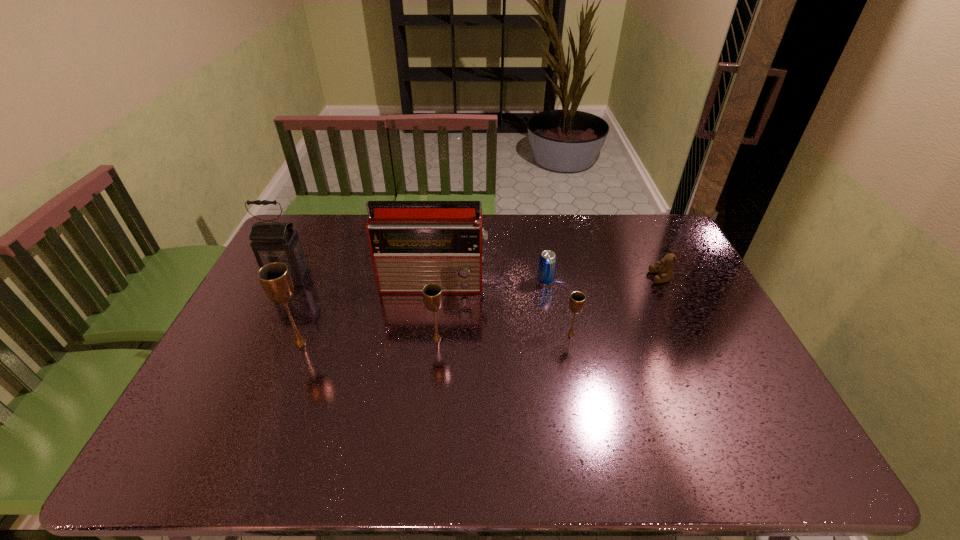
Identify the location of object that is at the right edge. (665, 272).

Locate an element on the screen. free space at the far edge of the desktop is located at coordinates (560, 249).

You are a GUI agent. You are given a task and a screenshot of the screen. Output one action in this format:
    pyautogui.click(x=<x>, y=<y>)
    Task: Click on the vacant space at the near edge of the desktop
    The width and height of the screenshot is (960, 540).
    Given the screenshot: What is the action you would take?
    pyautogui.click(x=634, y=411)

In the image, there is a desktop. At what (x,y) coordinates should I click in order to perform the action: click on vacant space at the left edge. Please return your answer as a coordinate pair (x, y). Image resolution: width=960 pixels, height=540 pixels. Looking at the image, I should click on (251, 349).

At what (x,y) coordinates should I click in order to perform the action: click on vacant region at the far left corner of the desktop. Please return your answer as a coordinate pair (x, y). The height and width of the screenshot is (540, 960). Looking at the image, I should click on (323, 248).

You are a GUI agent. You are given a task and a screenshot of the screen. Output one action in this format:
    pyautogui.click(x=<x>, y=<y>)
    Task: Click on the vacant space at the far right corner
    
    Given the screenshot: What is the action you would take?
    pyautogui.click(x=665, y=219)

Where is `free space that is in between the radio receiver and the lantern`? This screenshot has height=540, width=960. free space that is in between the radio receiver and the lantern is located at coordinates (362, 280).

The image size is (960, 540). I want to click on free space between the beer can and the rightmost object, so click(603, 279).

The width and height of the screenshot is (960, 540). In order to click on vacant region between the tallest chalice and the beer can in this screenshot , I will do coord(422,312).

Find the location of a particular element. vacant region between the fourth tallest object and the second object from left to right is located at coordinates (369, 340).